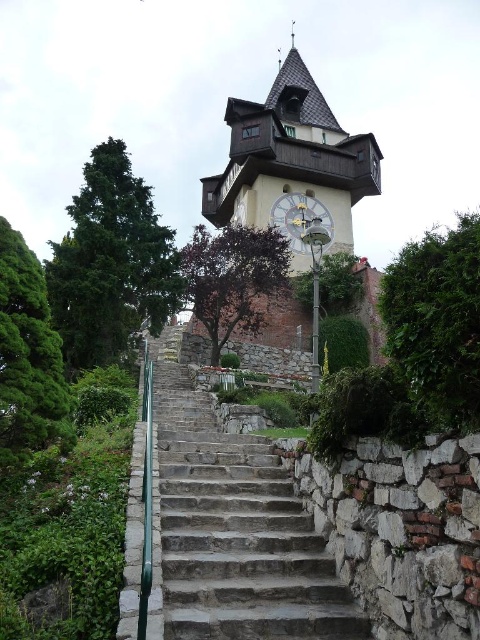
Can you confirm if purple leafy tree at center is shorter than white wooden clock at center?

Incorrect, purple leafy tree at center's height does not fall short of white wooden clock at center's.

Between point (240, 227) and point (274, 214), which one is positioned behind?

Positioned behind is point (274, 214).

In order to click on purple leafy tree at center in this screenshot , I will do `click(232, 278)`.

Is wooden clock tower at upper center taller than purple leafy tree at center?

Yes.

Is wooden clock tower at upper center further to camera compared to purple leafy tree at center?

Yes, wooden clock tower at upper center is behind purple leafy tree at center.

What do you see at coordinates (290, 156) in the screenshot?
I see `wooden clock tower at upper center` at bounding box center [290, 156].

What are the coordinates of `wooden clock tower at upper center` in the screenshot? It's located at (290, 156).

Is green leafy tree at right to the left of purple leafy tree at center from the viewer's perspective?

No, green leafy tree at right is not to the left of purple leafy tree at center.

Is green leafy tree at right thinner than purple leafy tree at center?

Yes, green leafy tree at right is thinner than purple leafy tree at center.

Identify the location of green leafy tree at right. pyautogui.click(x=436, y=321).

The image size is (480, 640). I want to click on green leafy tree at right, so click(x=436, y=321).